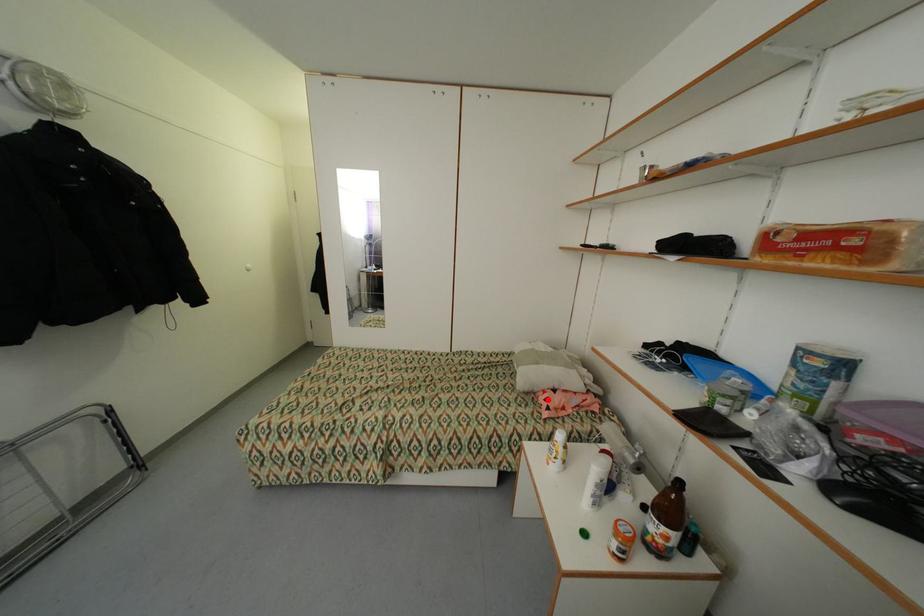
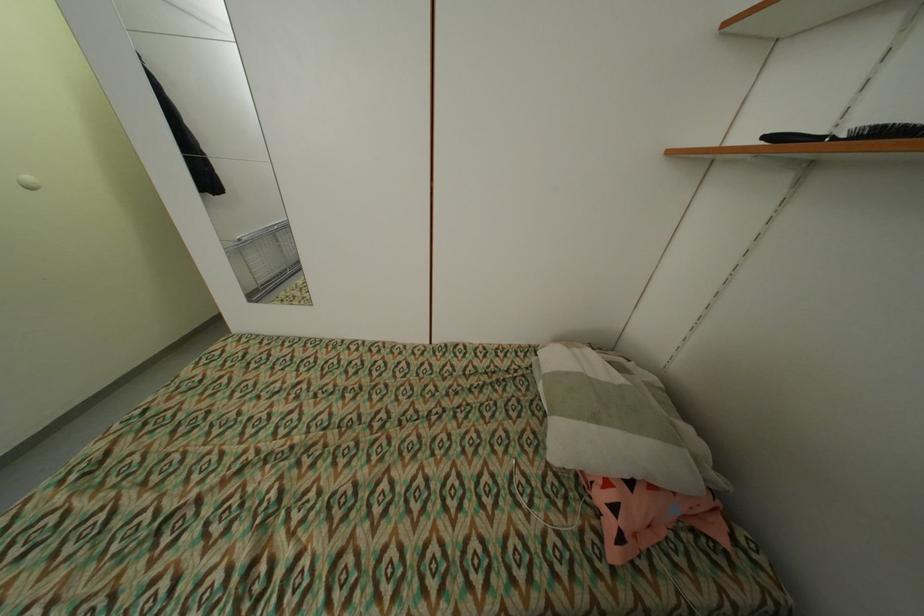
In the second image, find the point that corresponds to the highlighted location in the first image.

(606, 498)